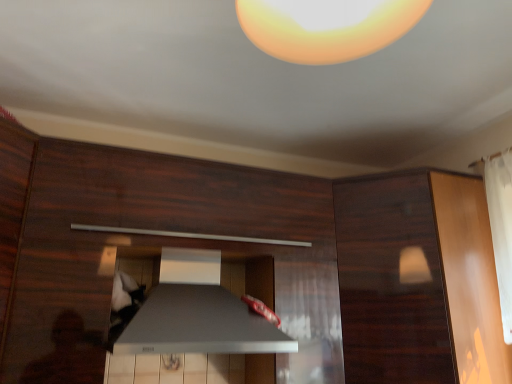
Question: Can satin silver drawer at center be found inside satin silver exhaust hood at center?

Choices:
 (A) no
 (B) yes

Answer: (A)

Question: From a real-world perspective, is satin silver exhaust hood at center located higher than satin silver drawer at center?

Choices:
 (A) no
 (B) yes

Answer: (A)

Question: Can you confirm if satin silver exhaust hood at center is bigger than satin silver drawer at center?

Choices:
 (A) no
 (B) yes

Answer: (A)

Question: Can you confirm if satin silver exhaust hood at center is wider than satin silver drawer at center?

Choices:
 (A) yes
 (B) no

Answer: (B)

Question: Can you confirm if satin silver exhaust hood at center is shorter than satin silver drawer at center?

Choices:
 (A) yes
 (B) no

Answer: (A)

Question: Does satin silver exhaust hood at center appear on the left side of satin silver drawer at center?

Choices:
 (A) no
 (B) yes

Answer: (B)

Question: Considering the relative positions of satin silver drawer at center and satin silver exhaust hood at center in the image provided, is satin silver drawer at center behind satin silver exhaust hood at center?

Choices:
 (A) yes
 (B) no

Answer: (B)

Question: From the image's perspective, is satin silver drawer at center over satin silver exhaust hood at center?

Choices:
 (A) yes
 (B) no

Answer: (A)

Question: Does satin silver drawer at center appear on the left side of satin silver exhaust hood at center?

Choices:
 (A) no
 (B) yes

Answer: (A)

Question: Can you confirm if satin silver drawer at center is taller than satin silver exhaust hood at center?

Choices:
 (A) no
 (B) yes

Answer: (B)

Question: Is satin silver drawer at center smaller than satin silver exhaust hood at center?

Choices:
 (A) yes
 (B) no

Answer: (B)

Question: Is satin silver drawer at center looking in the opposite direction of satin silver exhaust hood at center?

Choices:
 (A) no
 (B) yes

Answer: (B)

Question: Does dark wood cabinet at upper right come in front of satin silver exhaust hood at center?

Choices:
 (A) no
 (B) yes

Answer: (A)